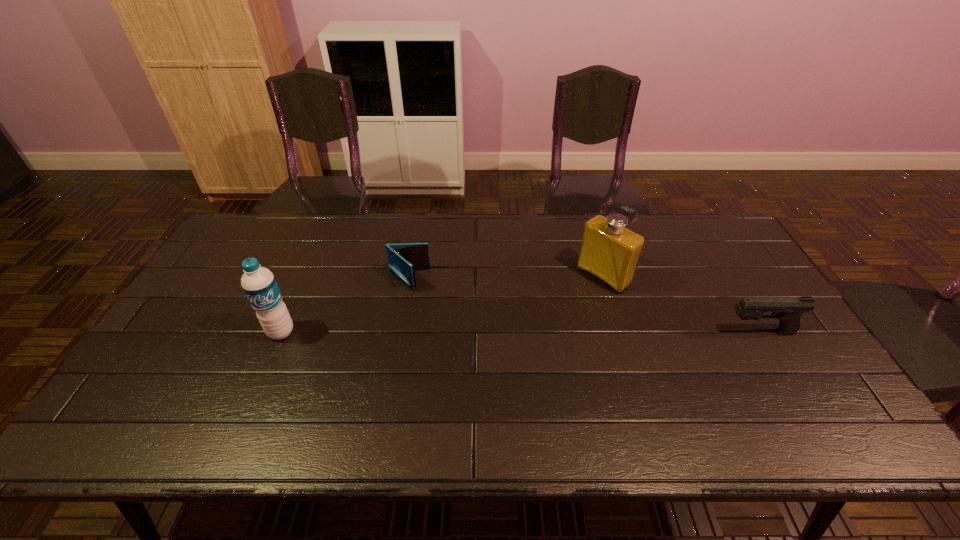
At what (x,y) coordinates should I click in order to perform the action: click on free spot at the right edge of the desktop. Please return your answer as a coordinate pair (x, y). The height and width of the screenshot is (540, 960). Looking at the image, I should click on (809, 360).

In the image, there is a desktop. At what (x,y) coordinates should I click in order to perform the action: click on vacant space at the far left corner. Please return your answer as a coordinate pair (x, y). The height and width of the screenshot is (540, 960). Looking at the image, I should click on (221, 249).

Locate an element on the screen. The width and height of the screenshot is (960, 540). vacant space at the far right corner is located at coordinates (670, 214).

Locate an element on the screen. This screenshot has width=960, height=540. vacant space that's between the shortest object and the pistol is located at coordinates (584, 306).

Image resolution: width=960 pixels, height=540 pixels. In order to click on free spot between the water bottle and the pistol in this screenshot , I will do (x=520, y=332).

The height and width of the screenshot is (540, 960). Find the location of `vacant space that is in between the pistol and the third object from right to left`. vacant space that is in between the pistol and the third object from right to left is located at coordinates (584, 306).

What are the coordinates of `unoccupied position between the leftmost object and the perfume` in the screenshot? It's located at (442, 304).

You are a GUI agent. You are given a task and a screenshot of the screen. Output one action in this format:
    pyautogui.click(x=<x>, y=<y>)
    Task: Click on the free spot between the leftmost object and the third object from left to right
    The width and height of the screenshot is (960, 540).
    Given the screenshot: What is the action you would take?
    [442, 304]

At what (x,y) coordinates should I click in order to perform the action: click on unoccupied position between the third object from right to left and the rightmost object. Please return your answer as a coordinate pair (x, y). Looking at the image, I should click on (584, 306).

Locate an element on the screen. The height and width of the screenshot is (540, 960). free space between the perfume and the rightmost object is located at coordinates (682, 304).